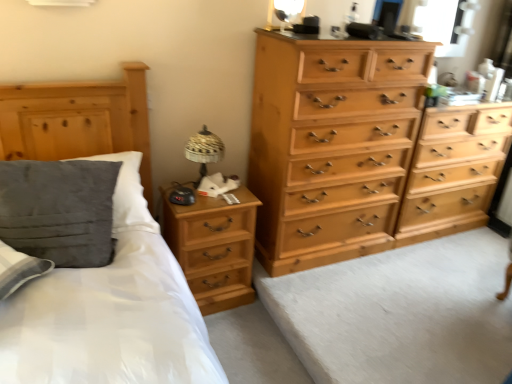
Question: Can you confirm if velvety gray pillow at left is positioned to the left of transparent glass window at upper right?

Choices:
 (A) no
 (B) yes

Answer: (B)

Question: Is the position of velvety gray pillow at left less distant than that of transparent glass window at upper right?

Choices:
 (A) yes
 (B) no

Answer: (A)

Question: Does velvety gray pillow at left have a smaller size compared to transparent glass window at upper right?

Choices:
 (A) yes
 (B) no

Answer: (B)

Question: From a real-world perspective, is velvety gray pillow at left under transparent glass window at upper right?

Choices:
 (A) no
 (B) yes

Answer: (B)

Question: From the image's perspective, does velvety gray pillow at left appear lower than transparent glass window at upper right?

Choices:
 (A) yes
 (B) no

Answer: (A)

Question: Which is correct: transparent glass window at upper right is inside matte gold table lamp at upper center, which is the 1th table lamp from top to bottom, or outside of it?

Choices:
 (A) inside
 (B) outside

Answer: (B)

Question: Looking at their shapes, would you say transparent glass window at upper right is wider or thinner than matte gold table lamp at upper center, the second table lamp when ordered from left to right?

Choices:
 (A) thin
 (B) wide

Answer: (B)

Question: Does point (456, 0) appear closer or farther from the camera than point (294, 11)?

Choices:
 (A) closer
 (B) farther

Answer: (B)

Question: Considering the relative positions of transparent glass window at upper right and matte gold table lamp at upper center, the second table lamp when ordered from left to right, in the image provided, is transparent glass window at upper right to the left or to the right of matte gold table lamp at upper center, the second table lamp when ordered from left to right,?

Choices:
 (A) left
 (B) right

Answer: (B)

Question: Choose the correct answer: Is light brown wood dresser at center inside light wood chest of drawers at right, the 2th chest of drawers in the right-to-left sequence, or outside it?

Choices:
 (A) inside
 (B) outside

Answer: (B)

Question: Is light brown wood dresser at center to the left or to the right of light wood chest of drawers at right, the 1th chest of drawers when ordered from left to right, in the image?

Choices:
 (A) right
 (B) left

Answer: (A)

Question: Considering their positions, is light brown wood dresser at center located in front of or behind light wood chest of drawers at right, the 2th chest of drawers in the right-to-left sequence?

Choices:
 (A) front
 (B) behind

Answer: (A)

Question: Considering the positions of light brown wood dresser at center and light wood chest of drawers at right, the 2th chest of drawers in the right-to-left sequence, in the image, is light brown wood dresser at center bigger or smaller than light wood chest of drawers at right, the 2th chest of drawers in the right-to-left sequence,?

Choices:
 (A) big
 (B) small

Answer: (B)

Question: Would you say light wood chest of drawers at center right, positioned as the second chest of drawers in left-to-right order, is to the left or to the right of light brown wood dresser at center in the picture?

Choices:
 (A) right
 (B) left

Answer: (A)

Question: Considering the positions of light wood chest of drawers at center right, marked as the 1th chest of drawers in a right-to-left arrangement, and light brown wood dresser at center in the image, is light wood chest of drawers at center right, marked as the 1th chest of drawers in a right-to-left arrangement, bigger or smaller than light brown wood dresser at center?

Choices:
 (A) big
 (B) small

Answer: (A)